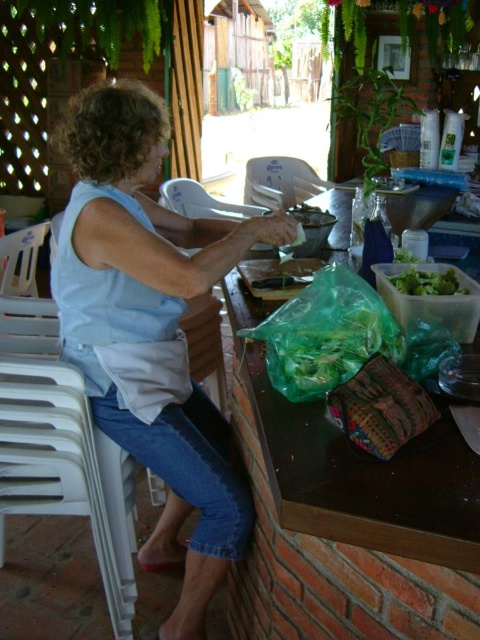
You are a delivery robot that is 1 meter wide. You need to deliver a package to the counter where the woman is working. The counter is against a brick wall. Can you fit through the space between the light blue fabric at center and the camera without hitting anything?

The distance between the light blue fabric at center and the camera is 1.18 meters. Since the robot is 1 meter wide, it can fit through the space as the distance is slightly larger than the robot.

You are organizing items on the counter and need to place the transparent plastic bag at center and the green leafy salad at center side by side. Which item should you place on the left to ensure they fit within the counter space?

The transparent plastic bag at center is wider than the green leafy salad at center. To fit them side by side, place the transparent plastic bag at center on the left since it is wider and requires more space.

You are a chef trying to reach the utensils on the counter. You see the light blue fabric at center and the transparent plastic bag at center. Which one is taller and might block your view of the utensils?

The light blue fabric at center is much taller than the transparent plastic bag at center, so it might block your view of the utensils.